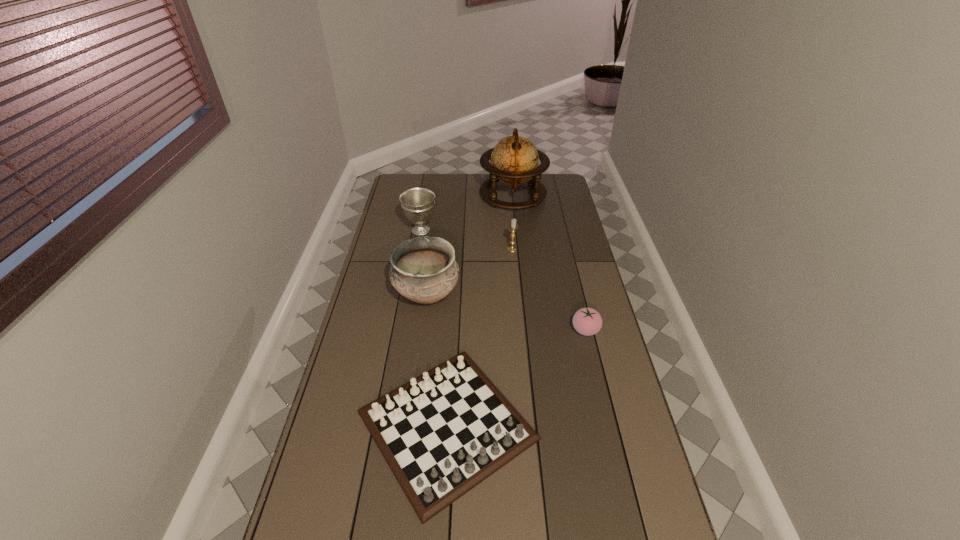
Locate an element on the screen. The height and width of the screenshot is (540, 960). object that is at the far right corner is located at coordinates [514, 160].

In the image, there is a desktop. At what (x,y) coordinates should I click in order to perform the action: click on vacant space at the far edge. Please return your answer as a coordinate pair (x, y). This screenshot has height=540, width=960. Looking at the image, I should click on (434, 186).

This screenshot has height=540, width=960. I want to click on vacant space at the left edge of the desktop, so click(x=379, y=298).

In the image, there is a desktop. Identify the location of vacant space at the right edge. point(560,275).

Identify the location of vacant space at the far right corner of the desktop. This screenshot has height=540, width=960. (561, 190).

Where is `unoccupied area between the candle holder and the shortest object`? unoccupied area between the candle holder and the shortest object is located at coordinates (479, 338).

At what (x,y) coordinates should I click in order to perform the action: click on free space between the fifth tallest object and the fourth nearest object. Please return your answer as a coordinate pair (x, y). The height and width of the screenshot is (540, 960). Looking at the image, I should click on (549, 289).

I want to click on free space between the pottery and the tallest object, so click(469, 245).

Image resolution: width=960 pixels, height=540 pixels. I want to click on free space between the farthest object and the pottery, so click(469, 245).

Locate an element on the screen. vacant point located between the chalice and the tomato is located at coordinates (503, 280).